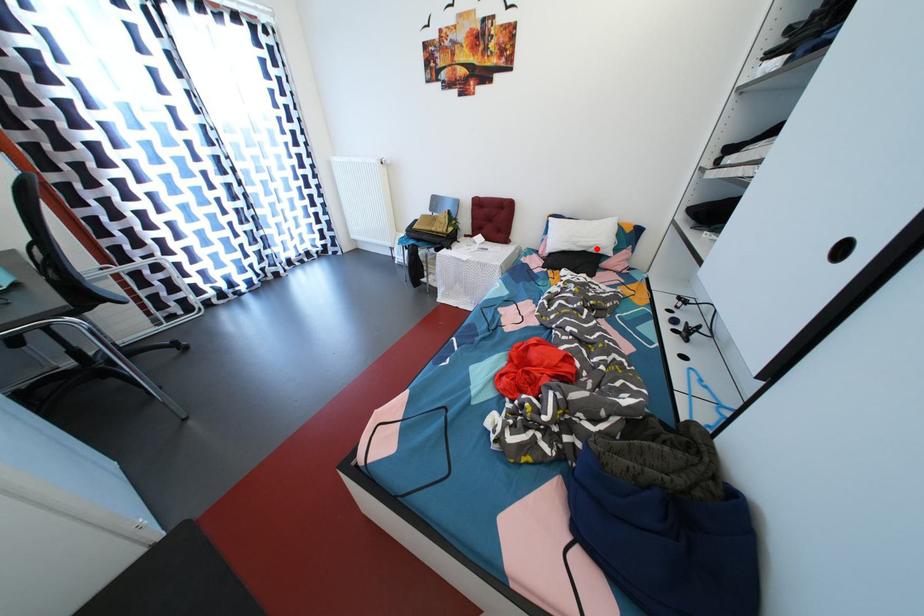
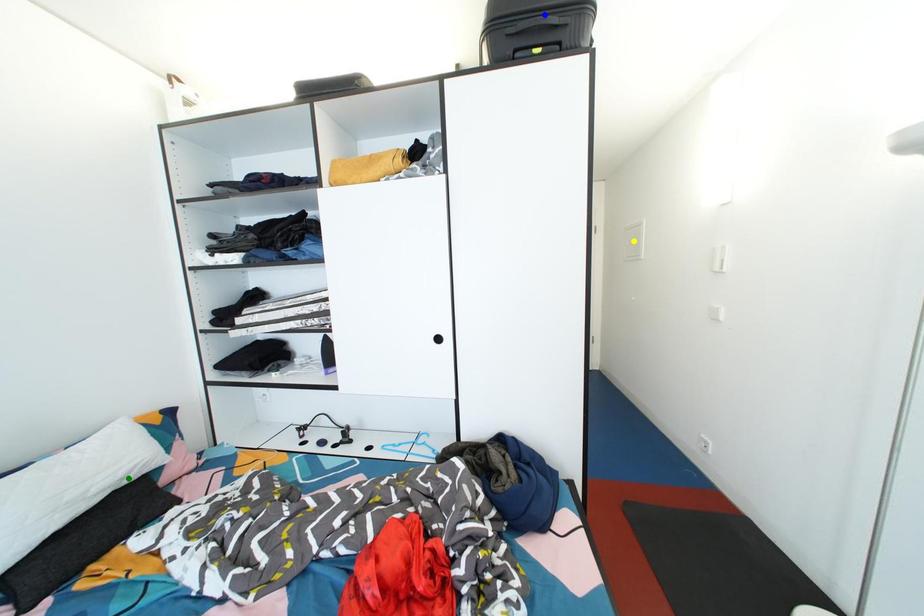
Question: I am providing you with two images of the same scene from different viewpoints. A red point is marked on the first image. You are given multiple points on the second image. Which point in image 2 is actually the same real-world point as the red point in image 1?

Choices:
 (A) green point
 (B) yellow point
 (C) blue point

Answer: (A)